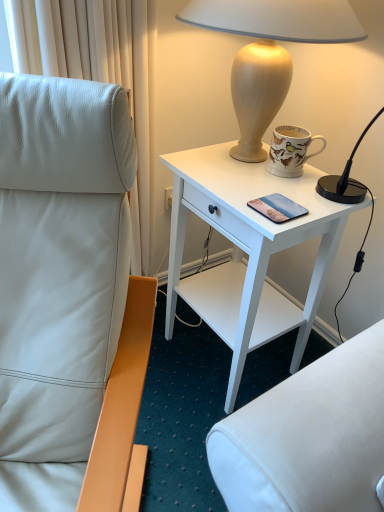
Question: Does matte glass mobile phone at center lie in front of porcelain mug with bird illustrations at upper right?

Choices:
 (A) yes
 (B) no

Answer: (A)

Question: Can you confirm if matte glass mobile phone at center is bigger than porcelain mug with bird illustrations at upper right?

Choices:
 (A) no
 (B) yes

Answer: (A)

Question: Is matte glass mobile phone at center taller than porcelain mug with bird illustrations at upper right?

Choices:
 (A) no
 (B) yes

Answer: (A)

Question: Considering the relative sizes of matte glass mobile phone at center and porcelain mug with bird illustrations at upper right in the image provided, is matte glass mobile phone at center smaller than porcelain mug with bird illustrations at upper right?

Choices:
 (A) yes
 (B) no

Answer: (A)

Question: Is matte glass mobile phone at center not within porcelain mug with bird illustrations at upper right?

Choices:
 (A) no
 (B) yes

Answer: (B)

Question: Is matte glass mobile phone at center positioned far away from porcelain mug with bird illustrations at upper right?

Choices:
 (A) yes
 (B) no

Answer: (B)

Question: Considering the relative sizes of porcelain mug with bird illustrations at upper right and white leather chair at left in the image provided, is porcelain mug with bird illustrations at upper right bigger than white leather chair at left?

Choices:
 (A) yes
 (B) no

Answer: (B)

Question: From the image's perspective, is porcelain mug with bird illustrations at upper right below white leather chair at left?

Choices:
 (A) no
 (B) yes

Answer: (A)

Question: From the image's perspective, is porcelain mug with bird illustrations at upper right located above white leather chair at left?

Choices:
 (A) yes
 (B) no

Answer: (A)

Question: Is porcelain mug with bird illustrations at upper right thinner than white leather chair at left?

Choices:
 (A) yes
 (B) no

Answer: (A)

Question: Is porcelain mug with bird illustrations at upper right at the left side of white leather chair at left?

Choices:
 (A) yes
 (B) no

Answer: (B)

Question: Is porcelain mug with bird illustrations at upper right outside white leather chair at left?

Choices:
 (A) no
 (B) yes

Answer: (B)

Question: Are matte glass mobile phone at center and white wood desk at upper right making contact?

Choices:
 (A) no
 (B) yes

Answer: (A)